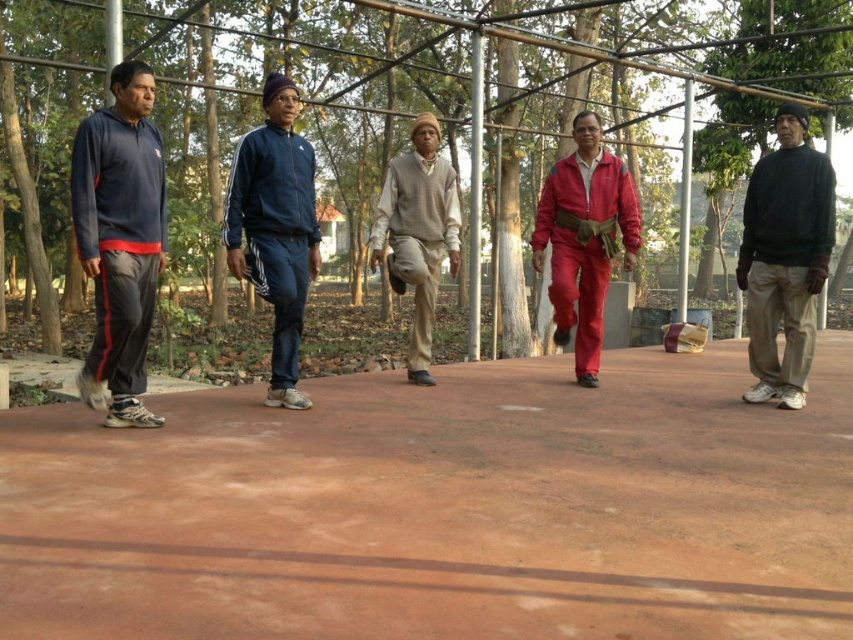
Between brown concrete path at center and red matte jumpsuit at center, which one has less height?

brown concrete path at center is shorter.

Between brown concrete path at center and red matte jumpsuit at center, which one appears on the right side from the viewer's perspective?

From the viewer's perspective, red matte jumpsuit at center appears more on the right side.

Find the location of `brown concrete path at center`. brown concrete path at center is located at coordinates (442, 508).

Locate an element on the screen. brown concrete path at center is located at coordinates (442, 508).

Can you confirm if dark blue track suit at left is positioned to the right of blue track suit at center?

In fact, dark blue track suit at left is to the left of blue track suit at center.

Which of these two, dark blue track suit at left or blue track suit at center, stands taller?

blue track suit at center

Find the location of a particular element. The height and width of the screenshot is (640, 853). dark blue track suit at left is located at coordinates (120, 241).

Identify the location of dark blue track suit at left. The height and width of the screenshot is (640, 853). (120, 241).

Can you confirm if dark blue track suit at left is positioned above dark gray sweater at right?

No, dark blue track suit at left is not above dark gray sweater at right.

Is dark blue track suit at left to the left of dark gray sweater at right from the viewer's perspective?

Indeed, dark blue track suit at left is positioned on the left side of dark gray sweater at right.

Is point (108, 193) less distant than point (785, 253)?

Yes, point (108, 193) is closer to viewer.

This screenshot has height=640, width=853. Identify the location of dark blue track suit at left. (120, 241).